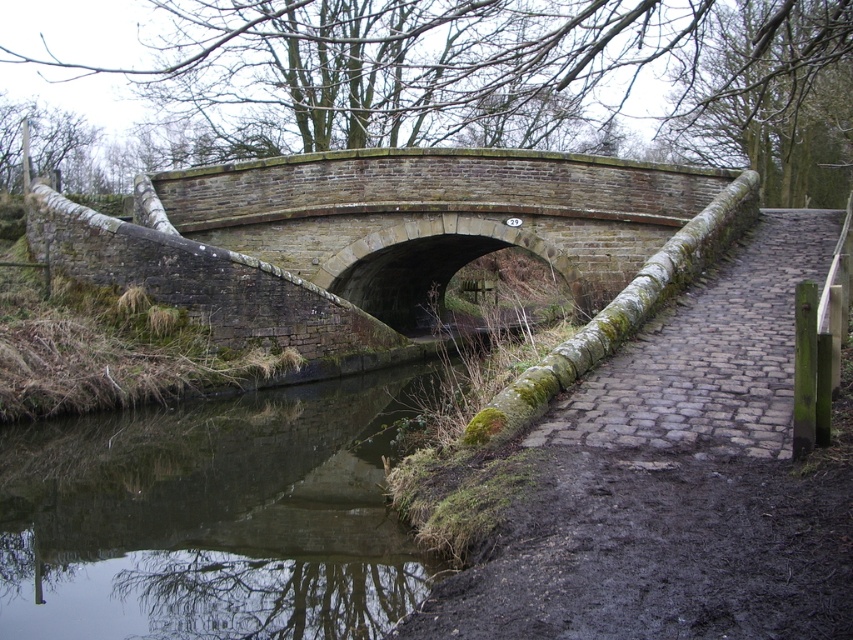
You are standing on the rustic stone bridge and notice the green mossy water at lower left. Where exactly is the green mossy water located in relation to the bridge?

The green mossy water at lower left is located at point coordinates 0.809 on the x axis and 0.249 on the y axis.

You are standing on the brick stone bridge at center and want to see the green mossy water at lower left. In which direction should you look from your current position?

You should look to the left because the brick stone bridge at center is positioned on the right side of green mossy water at lower left, meaning the water is to the left of the bridge.